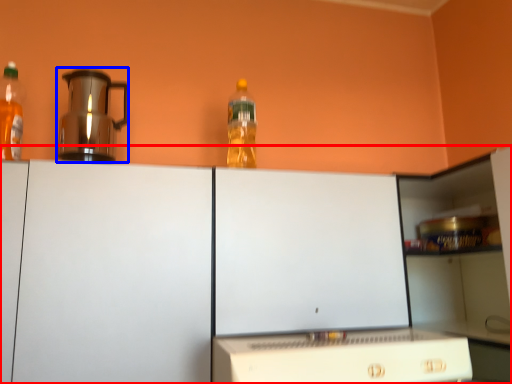
Question: Which object is further to the camera taking this photo, cabinetry (highlighted by a red box) or kitchen appliance (highlighted by a blue box)?

Choices:
 (A) cabinetry
 (B) kitchen appliance

Answer: (B)